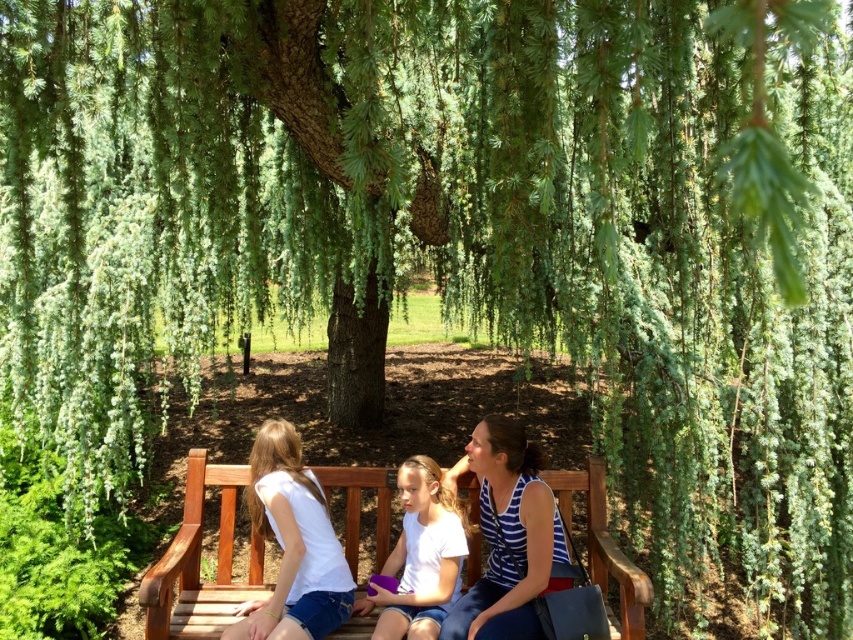
Between striped fabric top at center and white matte shirt at center, which one has more height?

striped fabric top at center is taller.

This screenshot has width=853, height=640. In order to click on striped fabric top at center in this screenshot , I will do `click(508, 534)`.

Can you confirm if wooden bench at center is shorter than white matte shirt at center?

Indeed, wooden bench at center has a lesser height compared to white matte shirt at center.

Locate an element on the screen. Image resolution: width=853 pixels, height=640 pixels. wooden bench at center is located at coordinates (199, 563).

Who is more forward, (206, 467) or (454, 496)?

Point (454, 496) is in front.

Locate an element on the screen. The height and width of the screenshot is (640, 853). wooden bench at center is located at coordinates (199, 563).

Is point (572, 513) closer to camera compared to point (480, 432)?

No.

I want to click on wooden bench at center, so click(x=199, y=563).